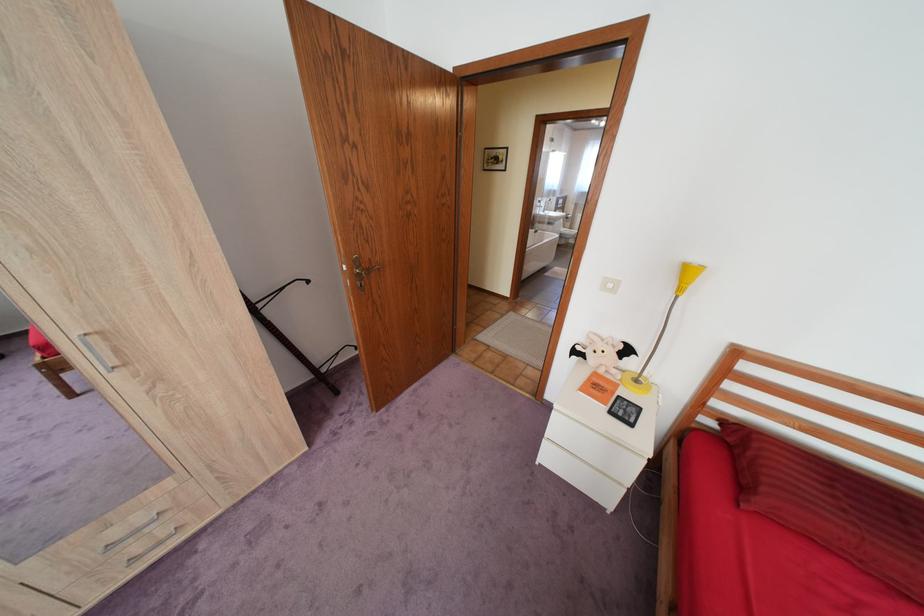
What do you see at coordinates (140, 567) in the screenshot? I see `a silver drawer handle` at bounding box center [140, 567].